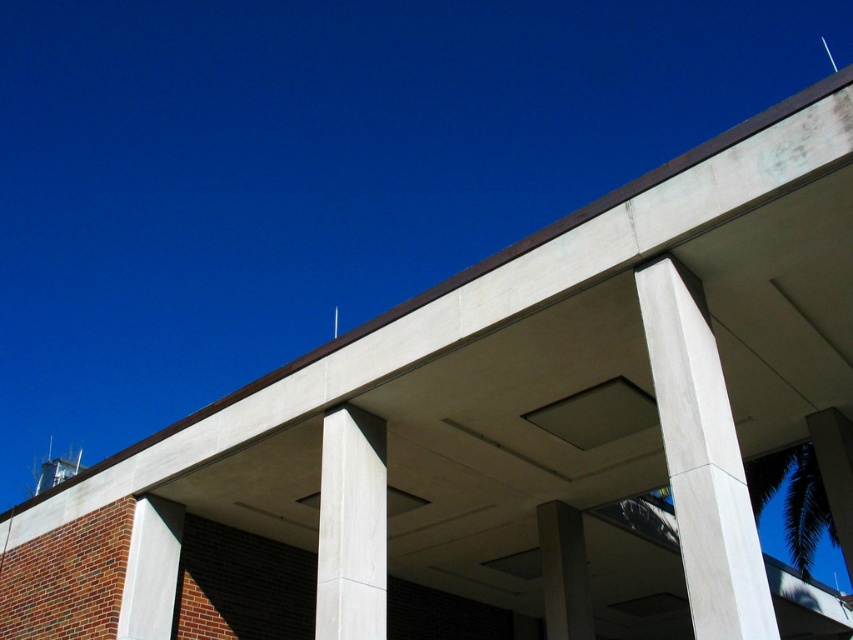
Does white smooth concrete pillar at center lie in front of smooth concrete pillar at center?

Yes, it is in front of smooth concrete pillar at center.

Which is more to the right, white smooth concrete pillar at center or smooth concrete pillar at center?

Positioned to the right is white smooth concrete pillar at center.

You are a GUI agent. You are given a task and a screenshot of the screen. Output one action in this format:
    pyautogui.click(x=<x>, y=<y>)
    Task: Click on the white smooth concrete pillar at center
    
    Given the screenshot: What is the action you would take?
    pyautogui.click(x=701, y=460)

This screenshot has height=640, width=853. What are the coordinates of `white smooth concrete pillar at center` in the screenshot? It's located at (701, 460).

Is point (664, 292) more distant than point (343, 442)?

No, it is not.

Does point (727, 456) come in front of point (323, 529)?

Yes, point (727, 456) is in front of point (323, 529).

Describe the element at coordinates (701, 460) in the screenshot. I see `white smooth concrete pillar at center` at that location.

Where is `white smooth concrete pillar at center`? This screenshot has width=853, height=640. white smooth concrete pillar at center is located at coordinates (701, 460).

Is white concrete column at center to the right of smooth concrete pillar at center from the viewer's perspective?

In fact, white concrete column at center is to the left of smooth concrete pillar at center.

Image resolution: width=853 pixels, height=640 pixels. What do you see at coordinates (351, 528) in the screenshot? I see `white concrete column at center` at bounding box center [351, 528].

Measure the distance between point (368, 529) and camera.

They are 8.43 meters apart.

Where is `white concrete column at center`? The image size is (853, 640). white concrete column at center is located at coordinates (351, 528).